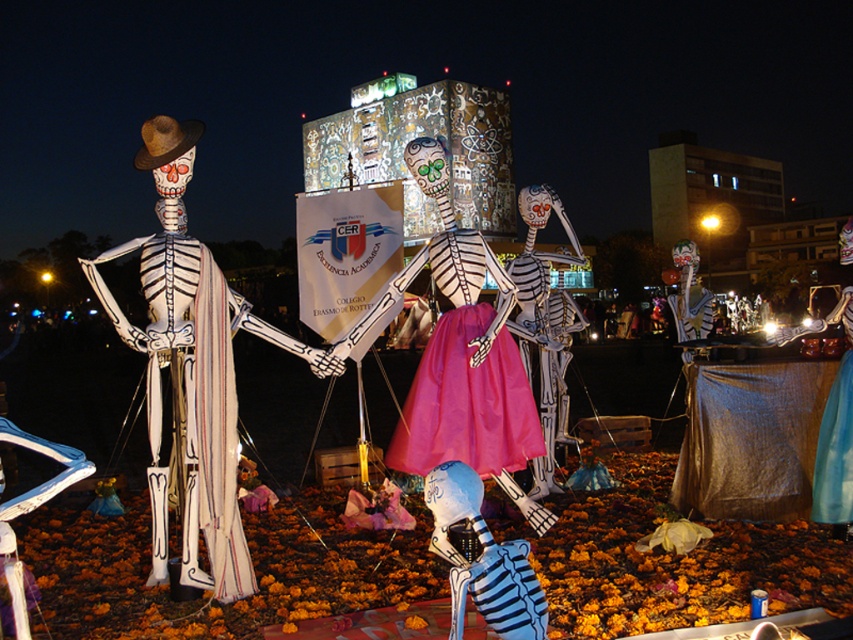
Describe the element at coordinates (483, 561) in the screenshot. I see `blue painted skeleton at lower center` at that location.

Where is `blue painted skeleton at lower center`? blue painted skeleton at lower center is located at coordinates (483, 561).

Who is more distant from viewer, (529, 449) or (851, 470)?

Point (529, 449)

Does pink satin dress at center have a lesser height compared to blue fabric dress at center?

Correct, pink satin dress at center is not as tall as blue fabric dress at center.

Between point (474, 424) and point (819, 435), which one is positioned behind?

The point (819, 435) is behind.

I want to click on pink satin dress at center, so click(466, 378).

Can you confirm if white paper skeleton at left is positioned below pink satin dress at center?

No.

Does point (187, 428) come farther from viewer compared to point (433, 348)?

No.

You are a GUI agent. You are given a task and a screenshot of the screen. Output one action in this format:
    pyautogui.click(x=<x>, y=<y>)
    Task: Click on the white paper skeleton at left
    This screenshot has width=853, height=640.
    Given the screenshot: What is the action you would take?
    pyautogui.click(x=194, y=355)